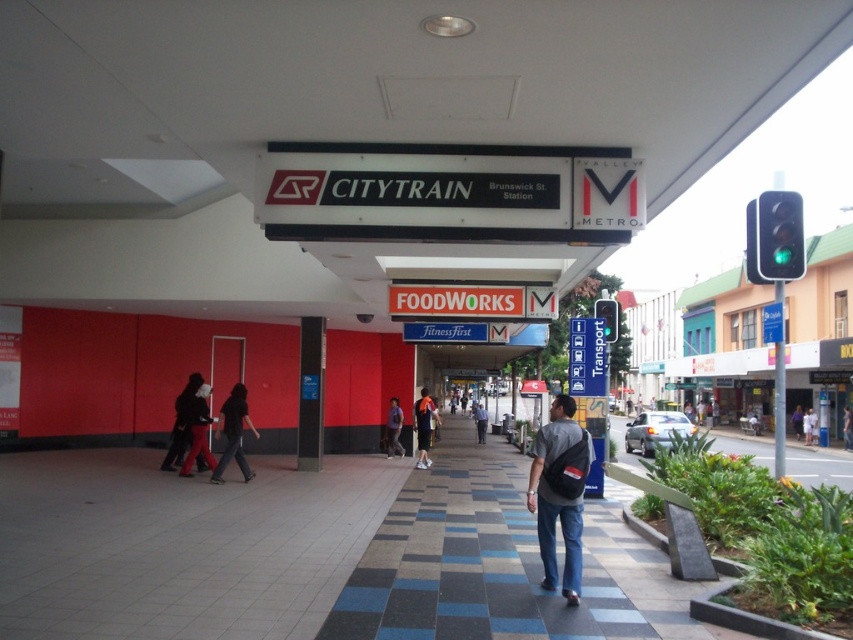
Who is lower down, dark gray jeans at center or matte black jacket at center?

matte black jacket at center is lower down.

Does dark gray jeans at center have a larger size compared to matte black jacket at center?

Actually, dark gray jeans at center might be smaller than matte black jacket at center.

Which is in front, point (238, 412) or point (209, 419)?

Point (209, 419)

You are a GUI agent. You are given a task and a screenshot of the screen. Output one action in this format:
    pyautogui.click(x=<x>, y=<y>)
    Task: Click on the dark gray jeans at center
    The image size is (853, 640).
    Given the screenshot: What is the action you would take?
    pyautogui.click(x=233, y=433)

Is matte black backpack at center wider than white cotton shirt at center?

In fact, matte black backpack at center might be narrower than white cotton shirt at center.

Can you confirm if matte black backpack at center is shorter than white cotton shirt at center?

Correct, matte black backpack at center is not as tall as white cotton shirt at center.

Locate an element on the screen. The height and width of the screenshot is (640, 853). matte black backpack at center is located at coordinates (556, 500).

Where is `matte black backpack at center`? This screenshot has width=853, height=640. matte black backpack at center is located at coordinates (556, 500).

Is matte black backpack at center smaller than dark gray jeans at center?

Indeed, matte black backpack at center has a smaller size compared to dark gray jeans at center.

This screenshot has width=853, height=640. What do you see at coordinates (556, 500) in the screenshot?
I see `matte black backpack at center` at bounding box center [556, 500].

Find the location of `matte black backpack at center`. matte black backpack at center is located at coordinates (556, 500).